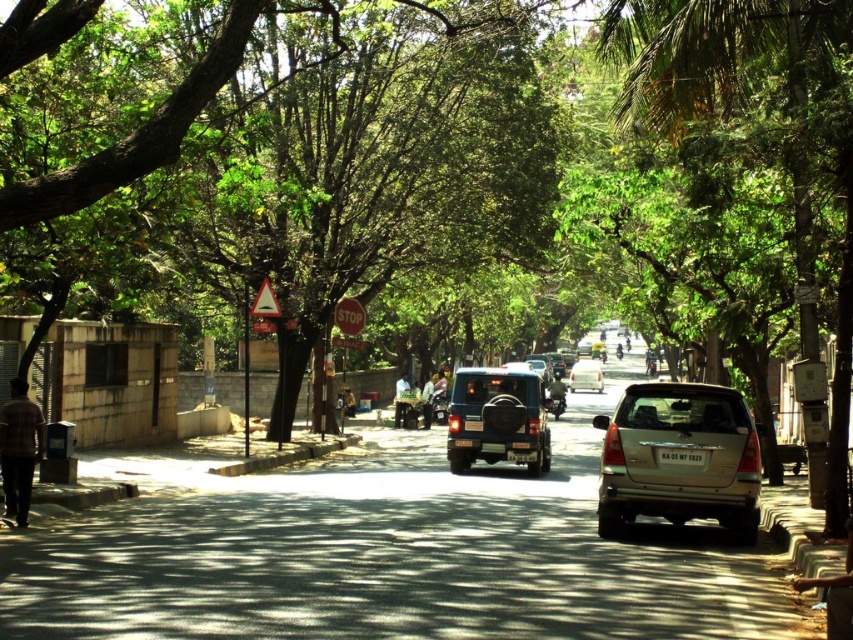
You are standing at the crosswalk and want to cross the street. There is a gold metallic suv at center. Based on its position, which direction should you look to ensure safety?

The gold metallic suv at center is located at coordinates approximately 0.717 on the x axis and 0.797 on the y axis, so you should look towards the center of the street where the gold metallic suv at center is positioned to ensure safety.

You are standing at the pedestrian crossing on the urban street. There are two points marked on the road ahead of you. The first point is at coordinates point (212,97) and the second point is at coordinates point (460,426). Which of these two points is closer to you as you stand at the pedestrian crossing?

Point (212,97) is in front of point (460,426), so it is closer to you as you stand at the pedestrian crossing.

You are standing at the pedestrian crossing and want to take a photo of the two points mentioned in the scene. Which point, point (747, 413) or point (527, 419), will appear larger in your camera view?

Point (747, 413) is closer to the camera than point (527, 419), so it will appear larger in the camera view.